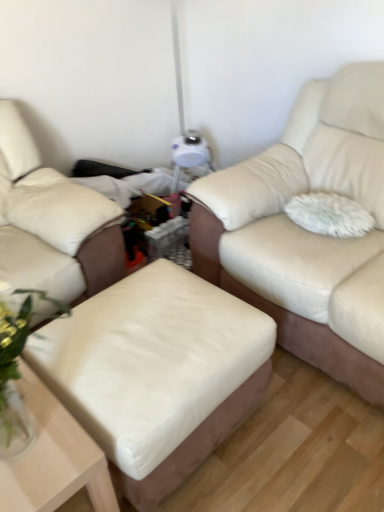
Question: Considering the relative positions of beige leather ottoman at lower left, which appears as the 2th studio couch when viewed from the right, and matte cream leather couch at center, marked as the 2th studio couch in a left-to-right arrangement, in the image provided, is beige leather ottoman at lower left, which appears as the 2th studio couch when viewed from the right, to the left of matte cream leather couch at center, marked as the 2th studio couch in a left-to-right arrangement, from the viewer's perspective?

Choices:
 (A) yes
 (B) no

Answer: (A)

Question: Can you confirm if beige leather ottoman at lower left, which is counted as the first studio couch, starting from the left, is shorter than matte cream leather couch at center, marked as the 2th studio couch in a left-to-right arrangement?

Choices:
 (A) no
 (B) yes

Answer: (A)

Question: From a real-world perspective, is beige leather ottoman at lower left, which appears as the 2th studio couch when viewed from the right, on top of matte cream leather couch at center, marked as the 2th studio couch in a left-to-right arrangement?

Choices:
 (A) yes
 (B) no

Answer: (B)

Question: Is beige leather ottoman at lower left, which is counted as the first studio couch, starting from the left, smaller than matte cream leather couch at center, which is counted as the 1th studio couch, starting from the right?

Choices:
 (A) no
 (B) yes

Answer: (B)

Question: Does beige leather ottoman at lower left, which appears as the 2th studio couch when viewed from the right, have a greater width compared to matte cream leather couch at center, marked as the 2th studio couch in a left-to-right arrangement?

Choices:
 (A) yes
 (B) no

Answer: (A)

Question: Looking at their shapes, would you say white matte table at lower left is wider or thinner than wooden cocktail table at center?

Choices:
 (A) wide
 (B) thin

Answer: (A)

Question: Would you say white matte table at lower left is to the left or to the right of wooden cocktail table at center in the picture?

Choices:
 (A) left
 (B) right

Answer: (A)

Question: In the image, is white matte table at lower left positioned in front of or behind wooden cocktail table at center?

Choices:
 (A) behind
 (B) front

Answer: (B)

Question: From a real-world perspective, is white matte table at lower left positioned above or below wooden cocktail table at center?

Choices:
 (A) above
 (B) below

Answer: (A)

Question: Is matte cream leather couch at center, which is counted as the 1th studio couch, starting from the right, inside the boundaries of white matte table at lower left, or outside?

Choices:
 (A) inside
 (B) outside

Answer: (B)

Question: In the image, is matte cream leather couch at center, which is counted as the 1th studio couch, starting from the right, positioned in front of or behind white matte table at lower left?

Choices:
 (A) behind
 (B) front

Answer: (A)

Question: From the image's perspective, is matte cream leather couch at center, marked as the 2th studio couch in a left-to-right arrangement, located above or below white matte table at lower left?

Choices:
 (A) above
 (B) below

Answer: (A)

Question: Visually, is matte cream leather couch at center, which is counted as the 1th studio couch, starting from the right, positioned to the left or to the right of white matte table at lower left?

Choices:
 (A) right
 (B) left

Answer: (A)

Question: From the image's perspective, is white fluffy pillow at right positioned above or below beige leather ottoman at lower left, which appears as the 2th studio couch when viewed from the right?

Choices:
 (A) above
 (B) below

Answer: (B)

Question: Is white fluffy pillow at right bigger or smaller than beige leather ottoman at lower left, which is counted as the first studio couch, starting from the left?

Choices:
 (A) small
 (B) big

Answer: (A)